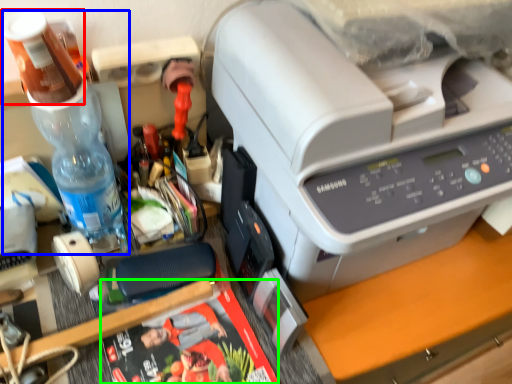
Question: Which object is the farthest from stationery (highlighted by a red box)? Choose among these: bottle (highlighted by a blue box) or magazine (highlighted by a green box).

Choices:
 (A) bottle
 (B) magazine

Answer: (B)